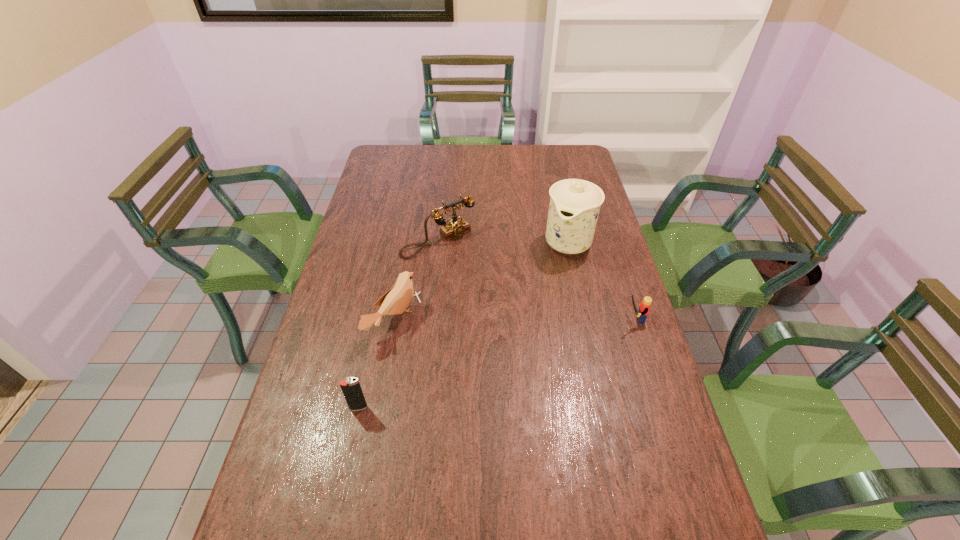
Identify the location of free space located on the front-facing side of the telephone. (498, 298).

Where is `vacant region located on the front-facing side of the telephone`? This screenshot has width=960, height=540. vacant region located on the front-facing side of the telephone is located at coordinates [x=531, y=332].

Image resolution: width=960 pixels, height=540 pixels. I want to click on free region located 0.160m on the front-facing side of the telephone, so click(x=486, y=285).

Locate an element on the screen. Image resolution: width=960 pixels, height=540 pixels. free space located on the spout of the tallest object is located at coordinates (549, 284).

The image size is (960, 540). I want to click on blank area located 0.260m on the spout of the tallest object, so (532, 316).

The image size is (960, 540). Identify the location of vacant point located on the spout of the tallest object. (554, 274).

In order to click on vacant area situated at the beak of the bird in this screenshot , I will do `click(496, 378)`.

In order to click on vacant space located 0.380m at the beak of the bird in this screenshot , I will do `click(534, 397)`.

Where is `vacant space situated at the beak of the bird`? vacant space situated at the beak of the bird is located at coordinates (530, 395).

This screenshot has width=960, height=540. I want to click on igniter that is at the left edge, so click(x=351, y=388).